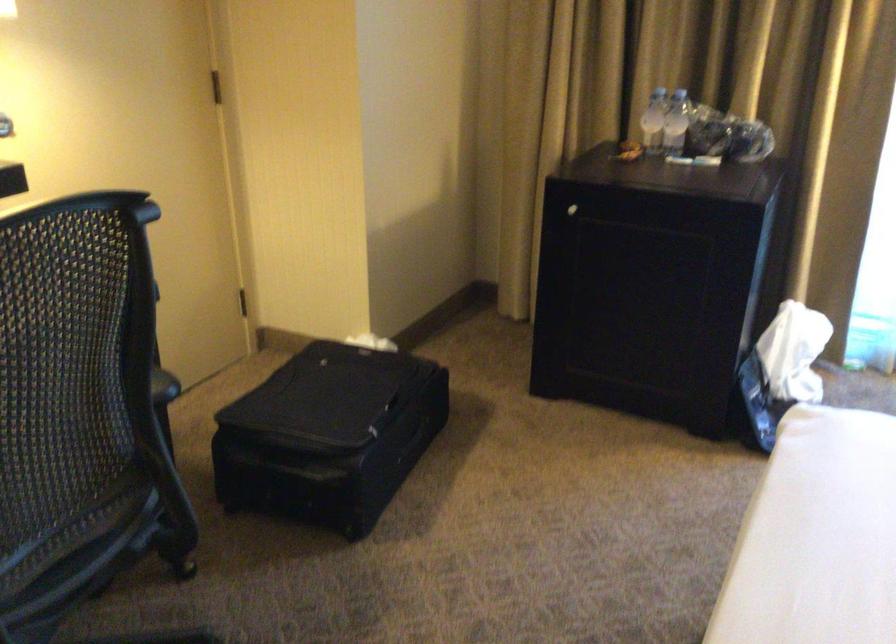
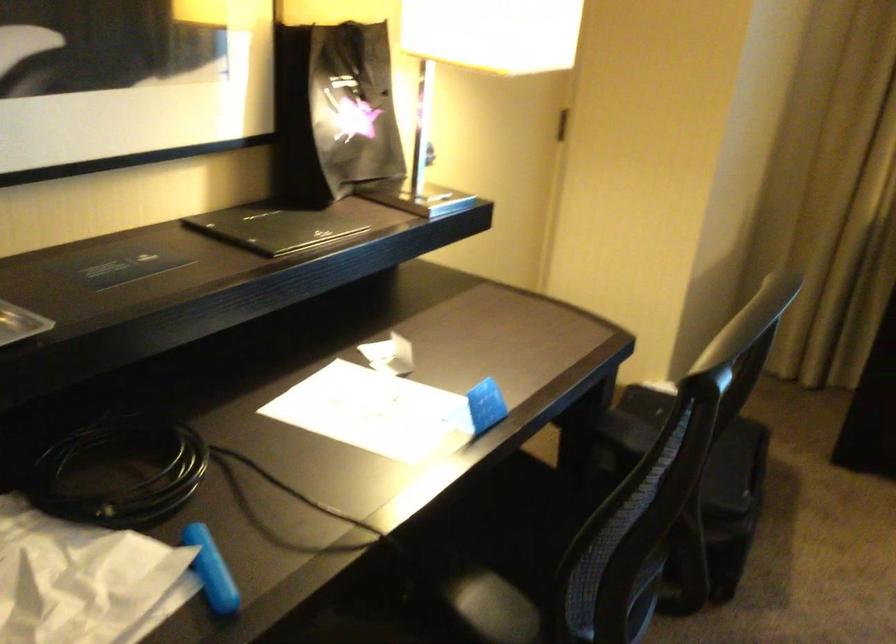
The point at (336, 556) is marked in the first image. Where is the corresponding point in the second image?

(709, 618)